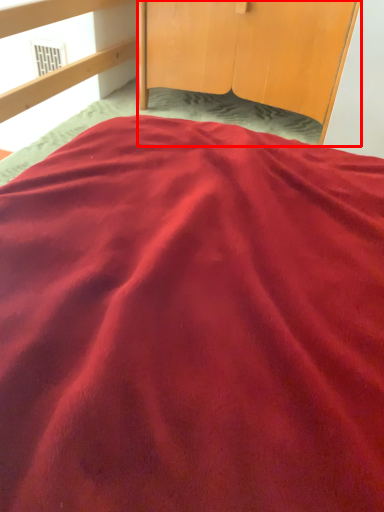
Question: Where is furniture (annotated by the red box) located in relation to window in the image?

Choices:
 (A) left
 (B) right

Answer: (B)